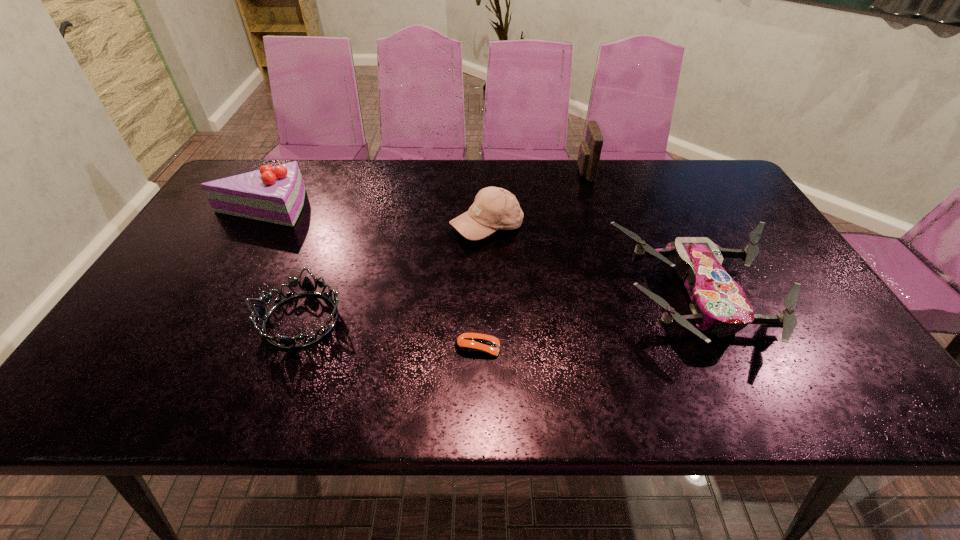
Where is `vacant space at the near edge of the desktop`? vacant space at the near edge of the desktop is located at coordinates (265, 397).

This screenshot has width=960, height=540. Find the location of `vacant point at the left edge`. vacant point at the left edge is located at coordinates (183, 269).

Image resolution: width=960 pixels, height=540 pixels. Identify the location of vacant space at the right edge of the desktop. (700, 208).

The image size is (960, 540). I want to click on free spot between the computer mouse and the pouch, so click(531, 260).

Identify the location of unoccupied area between the farthest object and the fourth shortest object. (536, 200).

The height and width of the screenshot is (540, 960). Identify the location of empty location between the baseball cap and the third shortest object. (594, 262).

This screenshot has width=960, height=540. What are the coordinates of `free space between the shortest object and the tiara` in the screenshot? It's located at (x=390, y=334).

The height and width of the screenshot is (540, 960). I want to click on free space between the pouch and the baseball cap, so pos(536,200).

This screenshot has width=960, height=540. What are the coordinates of `free space between the tiara and the pouch` in the screenshot? It's located at (443, 246).

Find the location of a particular element. free point between the drone and the shortest object is located at coordinates (589, 323).